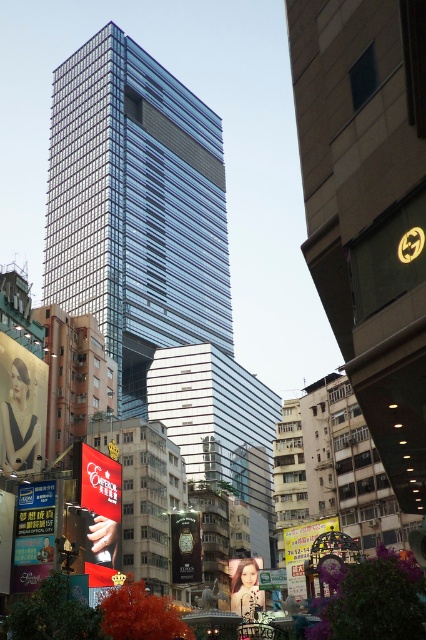
Which of these two, matte black billboard at lower left or matte red billboard at lower left, stands taller?

Standing taller between the two is matte black billboard at lower left.

Find the location of a particular element. The width and height of the screenshot is (426, 640). matte black billboard at lower left is located at coordinates (22, 406).

Locate an element on the screen. matte black billboard at lower left is located at coordinates (22, 406).

Which is more to the right, transparent glass tower at center or blue glossy billboard at lower left?

transparent glass tower at center is more to the right.

Who is more forward, (120, 77) or (43, 513)?

Point (43, 513)

The image size is (426, 640). Find the location of `transparent glass tower at center`. transparent glass tower at center is located at coordinates (135, 208).

Which is more to the left, glassy metallic skyscraper at center or blue glossy billboard at lower left?

Positioned to the left is blue glossy billboard at lower left.

Is glassy metallic skyscraper at center wider than blue glossy billboard at lower left?

Correct, the width of glassy metallic skyscraper at center exceeds that of blue glossy billboard at lower left.

Which is in front, point (362, 400) or point (34, 548)?

Point (362, 400) is in front.

Image resolution: width=426 pixels, height=640 pixels. I want to click on glassy metallic skyscraper at center, so click(x=368, y=208).